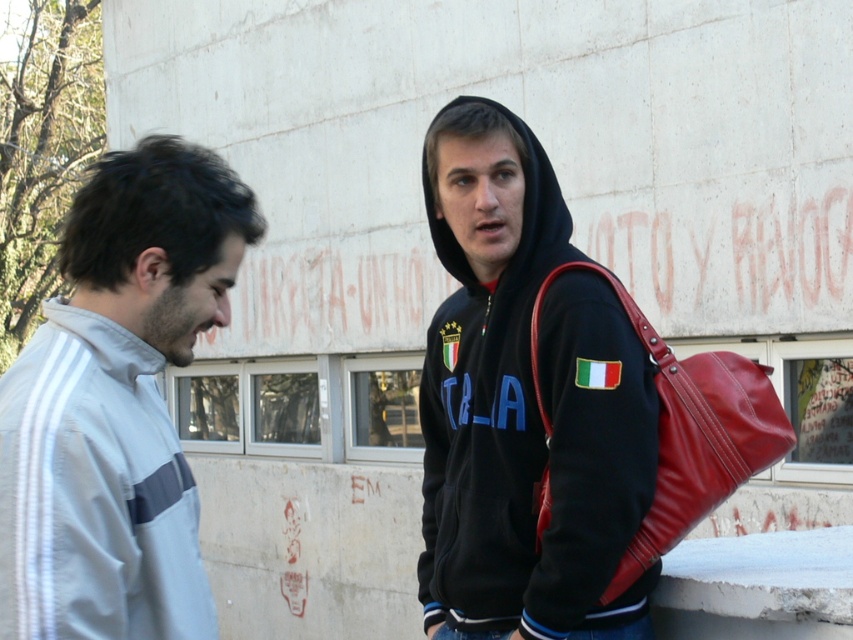
You are a photographer trying to capture a photo of both the black fleece hoodie at center and the light gray fabric jacket at left in the same frame. Given that your camera has a minimum focus distance of 60 centimeters, will you be able to focus on both subjects clearly?

The black fleece hoodie at center and light gray fabric jacket at left are 64.57 centimeters apart from each other. Since the distance between them is greater than the camera minimum focus distance of 60 centimeters, the camera can focus on both subjects clearly.

You are standing in the same location as the photographer who took the image. You want to locate the black fleece hoodie at center. Which direction should you look relative to the center of the image?

You should look towards the coordinates point at (524, 403) to locate the black fleece hoodie at center.